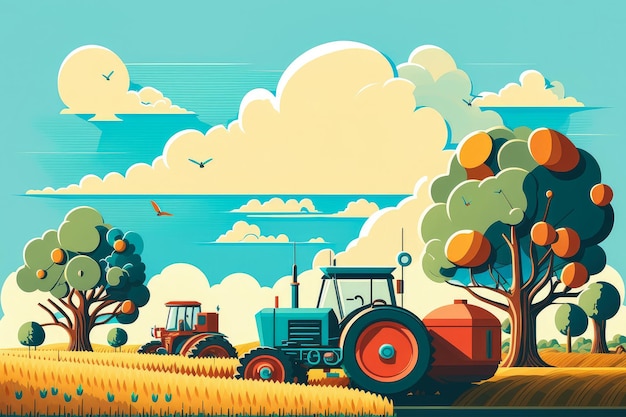
The image size is (626, 417). In order to click on windows in this screenshot , I will do 175,316, 178,313, 193,315, 327,302, 349,287, 380,288.